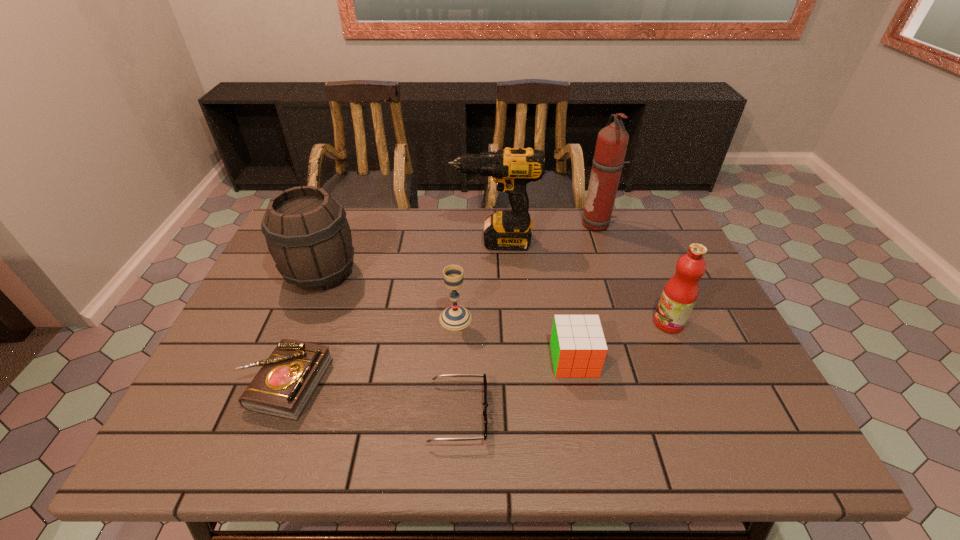
Find the location of `free space located on the back of the cube`. free space located on the back of the cube is located at coordinates (562, 295).

In order to click on vacant area located 0.120m on the back of the diary in this screenshot , I will do `click(311, 314)`.

Locate an element on the screen. This screenshot has height=540, width=960. free space located on the front-facing side of the spectacles is located at coordinates (638, 414).

You are a GUI agent. You are given a task and a screenshot of the screen. Output one action in this format:
    pyautogui.click(x=<x>, y=<y>)
    Task: Click on the fire extinguisher that is at the far edge
    Image resolution: width=960 pixels, height=540 pixels.
    Given the screenshot: What is the action you would take?
    pyautogui.click(x=612, y=141)

Find the location of a particular element. The width and height of the screenshot is (960, 540). drill present at the far edge is located at coordinates (511, 168).

Where is `wine bucket present at the far edge`? The image size is (960, 540). wine bucket present at the far edge is located at coordinates (307, 233).

Find the location of a particular element. diary situated at the near edge is located at coordinates (285, 383).

What are the coordinates of `spectacles present at the near edge` in the screenshot? It's located at (485, 403).

Identify the location of wine bucket at the left edge. This screenshot has height=540, width=960. (307, 233).

The height and width of the screenshot is (540, 960). What are the coordinates of `diary that is at the left edge` in the screenshot? It's located at (285, 383).